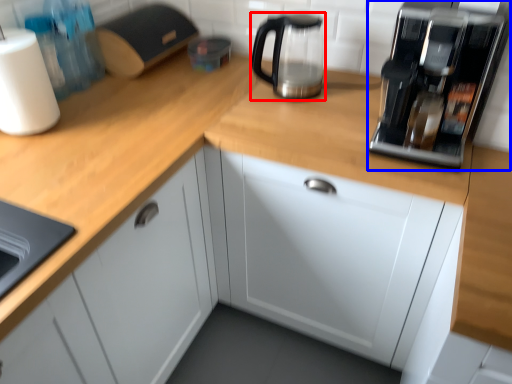
Question: Which object is further to the camera taking this photo, kitchen appliance (highlighted by a red box) or home appliance (highlighted by a blue box)?

Choices:
 (A) kitchen appliance
 (B) home appliance

Answer: (A)